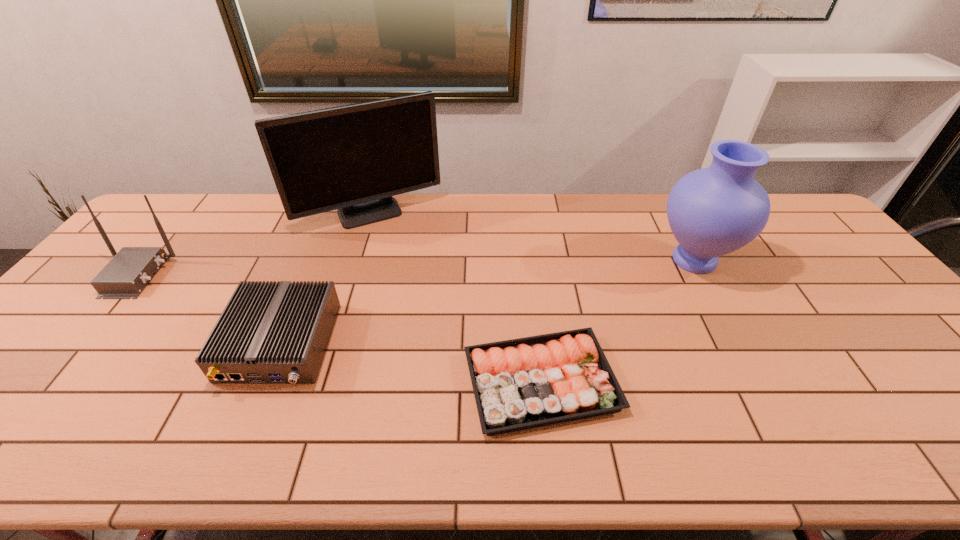
At what (x,y) coordinates should I click in order to perform the action: click on vacant area located on the back of the third tallest object to connect cables. Please return your answer as a coordinate pair (x, y). Looking at the image, I should click on (267, 275).

Where is `free region located on the back panel of the nearer router`? free region located on the back panel of the nearer router is located at coordinates (230, 461).

Locate an element on the screen. The height and width of the screenshot is (540, 960). free region located 0.340m on the back of the platter is located at coordinates (526, 250).

Locate an element on the screen. The width and height of the screenshot is (960, 540). object present at the far edge is located at coordinates (353, 158).

Locate an element on the screen. This screenshot has width=960, height=540. object that is at the near edge is located at coordinates (518, 384).

Locate an element on the screen. The width and height of the screenshot is (960, 540). object located in the left edge section of the desktop is located at coordinates (130, 270).

This screenshot has height=540, width=960. In the image, there is a desktop. Identify the location of vacant space at the far edge. (593, 193).

The image size is (960, 540). In the image, there is a desktop. What are the coordinates of `free space at the near edge` in the screenshot? It's located at (611, 426).

The image size is (960, 540). In the image, there is a desktop. Identify the location of free space at the right edge. (922, 394).

You are a GUI agent. You are given a task and a screenshot of the screen. Output one action in this format:
    pyautogui.click(x=<x>, y=<y>)
    Task: Click on the vacant region at the far left corner
    The height and width of the screenshot is (540, 960).
    Given the screenshot: What is the action you would take?
    pyautogui.click(x=188, y=195)